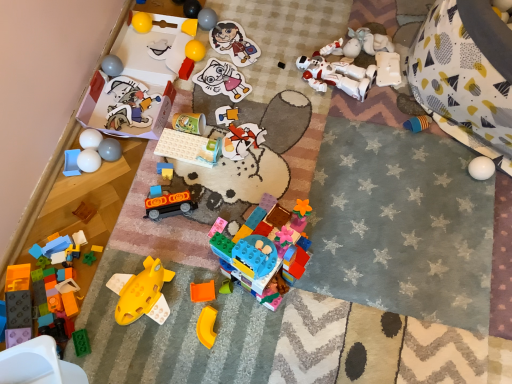
Locate an element on the screen. This screenshot has width=512, height=384. free spot to the right of matte paper sticker at center, the eighteenth toy positioned from the left is located at coordinates (274, 85).